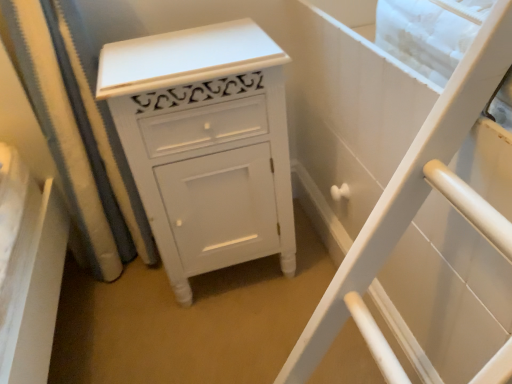
Question: Does white painted wood cabinet at center appear on the left side of white fabric shower curtain at left?

Choices:
 (A) yes
 (B) no

Answer: (B)

Question: Is white fabric shower curtain at left surrounded by white painted wood cabinet at center?

Choices:
 (A) no
 (B) yes

Answer: (A)

Question: From the image's perspective, would you say white painted wood cabinet at center is positioned over white fabric shower curtain at left?

Choices:
 (A) no
 (B) yes

Answer: (A)

Question: Considering the relative sizes of white painted wood cabinet at center and white fabric shower curtain at left in the image provided, is white painted wood cabinet at center smaller than white fabric shower curtain at left?

Choices:
 (A) no
 (B) yes

Answer: (A)

Question: From a real-world perspective, is white painted wood cabinet at center positioned over white fabric shower curtain at left based on gravity?

Choices:
 (A) no
 (B) yes

Answer: (A)

Question: Is white painted wood cabinet at center at the right side of white fabric shower curtain at left?

Choices:
 (A) no
 (B) yes

Answer: (B)

Question: Can you confirm if white fabric shower curtain at left is wider than white painted wood cabinet at center?

Choices:
 (A) yes
 (B) no

Answer: (B)

Question: Are white fabric shower curtain at left and white painted wood cabinet at center located far from each other?

Choices:
 (A) yes
 (B) no

Answer: (B)

Question: Can you confirm if white fabric shower curtain at left is shorter than white painted wood cabinet at center?

Choices:
 (A) no
 (B) yes

Answer: (A)

Question: Is white fabric shower curtain at left at the left side of white painted wood cabinet at center?

Choices:
 (A) yes
 (B) no

Answer: (A)

Question: Is white fabric shower curtain at left next to white painted wood cabinet at center and touching it?

Choices:
 (A) no
 (B) yes

Answer: (A)

Question: From a real-world perspective, is white fabric shower curtain at left under white painted wood cabinet at center?

Choices:
 (A) yes
 (B) no

Answer: (B)

Question: From a real-world perspective, is white fabric shower curtain at left physically located above or below white painted wood cabinet at center?

Choices:
 (A) below
 (B) above

Answer: (B)